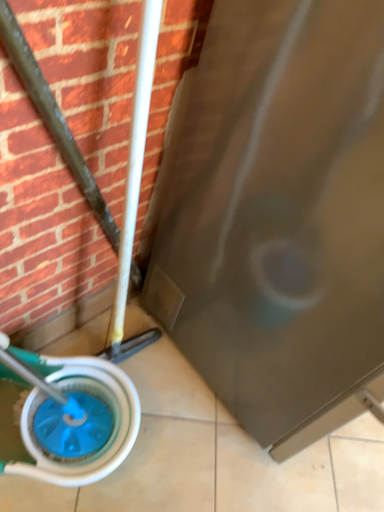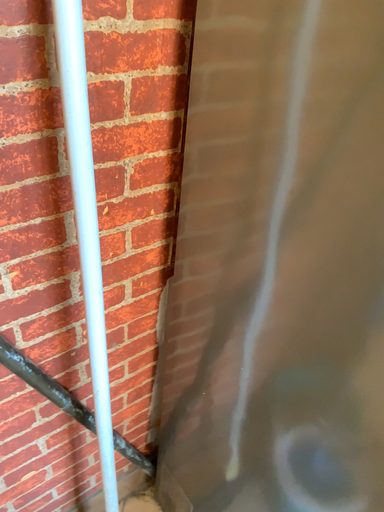
Question: How did the camera likely rotate when shooting the video?

Choices:
 (A) rotated upward
 (B) rotated downward

Answer: (A)